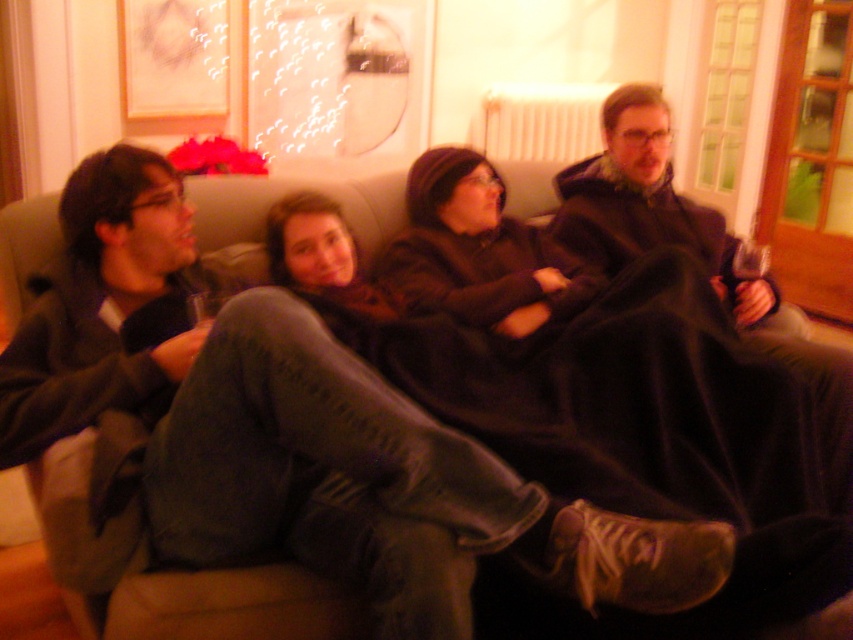
Is point (408, 596) in front of point (740, 314)?

Yes.

What do you see at coordinates (126, 365) in the screenshot?
I see `dark gray hoodie at center` at bounding box center [126, 365].

This screenshot has width=853, height=640. Find the location of `dark gray hoodie at center`. dark gray hoodie at center is located at coordinates (126, 365).